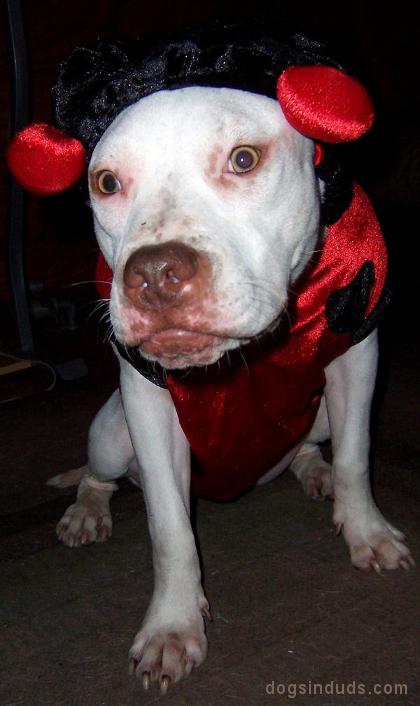
Image resolution: width=420 pixels, height=706 pixels. In order to click on carpet in this screenshot , I will do `click(264, 615)`.